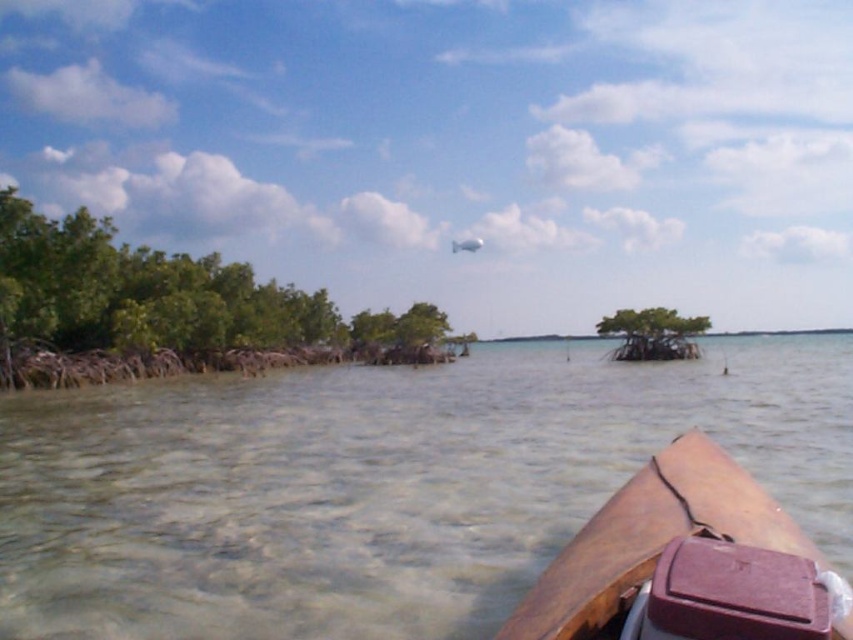
You are a marine biologist on a research boat and need to collect water samples from the clear water at lower center. Your boat, the brown leather boat at lower right, has a sampling device that can reach up to 15 meters. Can you collect the sample without moving your boat?

The distance between the clear water at lower center and the brown leather boat at lower right is 17.25 meters. Since the sampling device can only reach up to 15 meters, you cannot collect the sample without moving the boat.

You are a marine biologist observing the coastal ecosystem from a boat. You notice the clear water at lower center and the brown leather boat at lower right. Which object is positioned higher in the image?

The clear water at lower center is much taller than the brown leather boat at lower right, so the clear water at lower center is positioned higher in the image.